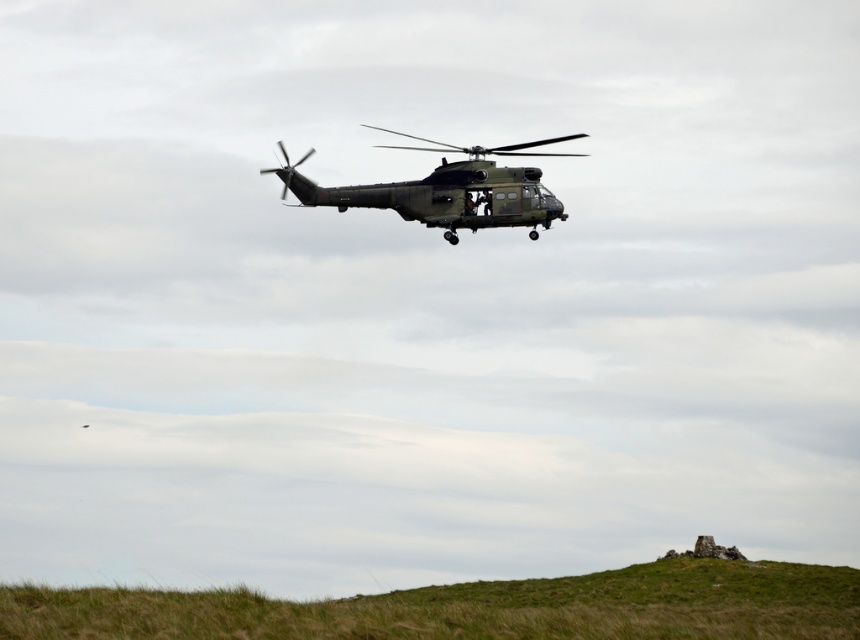
Is green grassy hill at lower center in front of matte green helicopter at center?

That is True.

Is point (748, 582) in front of point (585, 134)?

That is True.

Who is more distant from viewer, [607,608] or [452,212]?

The point [452,212] is behind.

Identify the location of green grassy hill at lower center. (473, 608).